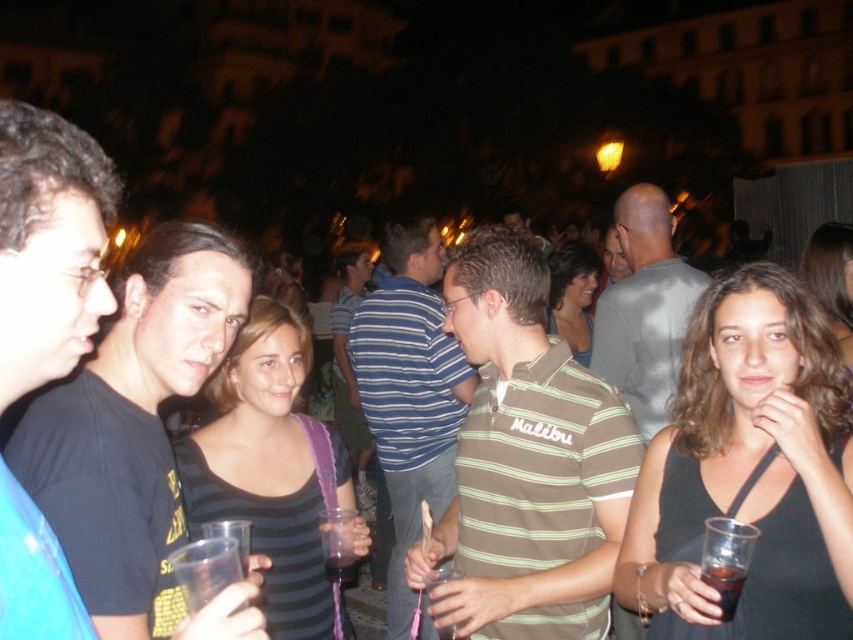
You are at the point marked as point [643,308] in the image. What is the closest object to you?

The closest object to you at point [643,308] is the gray cotton shirt at center.

You are at a party and want to hand a drink to someone. You see the gray cotton shirt at center and the dark brown liquid at lower right. Which person should you approach to give the drink to, and why?

You should approach the gray cotton shirt at center because they are positioned to the right of the dark brown liquid at lower right, indicating they might be holding or near the drink.

You are at the event and want to find the person wearing the striped cotton shirt at center. Which direction should you look relative to the black matte shirt at left?

The striped cotton shirt at center is taller than the black matte shirt at left. Since the black matte shirt at left is shorter, you should look upward from the black matte shirt at left to find the striped cotton shirt at center.